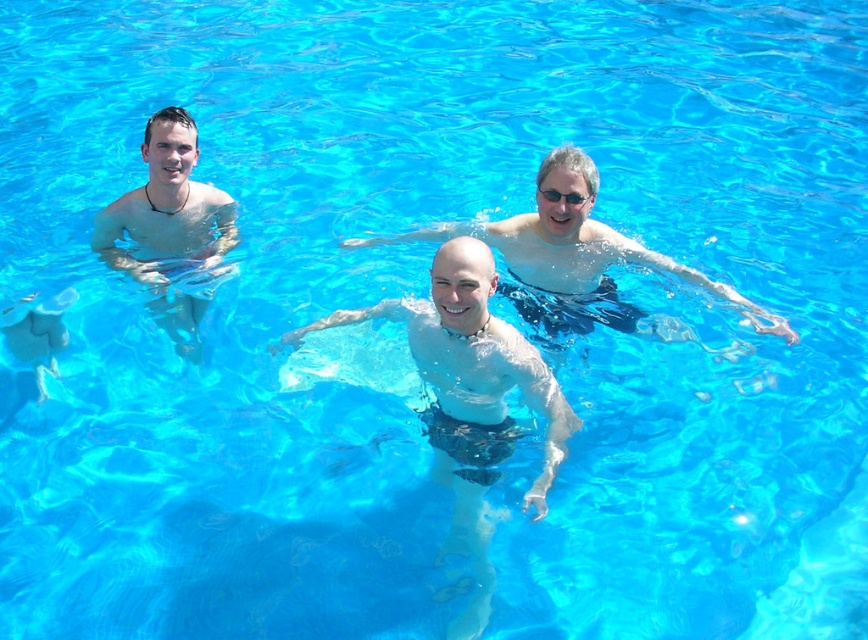
You are a photographer trying to capture a clear shot of the bare skin at center and the matte black swim trunks at left. Considering their heights, which one might be easier to frame without any obstructions?

The bare skin at center is much taller than the matte black swim trunks at left, so it might be easier to frame the matte black swim trunks at left without obstructions since they are shorter and less likely to block the view.

You are a lifeguard observing the pool area. There is a point marked at coordinates (169, 227). What object is located at that point?

The point at coordinates (169, 227) marks the location of the matte black swim trunks at left.